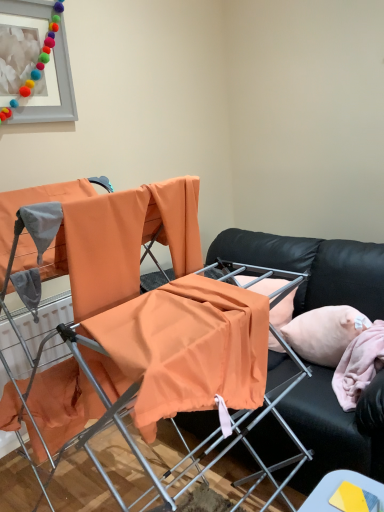
Question: From their relative heights in the image, would you say orange fabric chair at center is taller or shorter than black leather couch at center?

Choices:
 (A) tall
 (B) short

Answer: (A)

Question: Based on their sizes in the image, would you say orange fabric chair at center is bigger or smaller than black leather couch at center?

Choices:
 (A) small
 (B) big

Answer: (B)

Question: Which object is positioned closest to the orange fabric chair at center?

Choices:
 (A) smooth yellow card at lower right
 (B) matte gray picture frame at upper left
 (C) pink fabric pillow at right
 (D) black leather couch at center

Answer: (A)

Question: Which object is positioned closest to the matte gray picture frame at upper left?

Choices:
 (A) orange fabric chair at center
 (B) smooth yellow card at lower right
 (C) black leather couch at center
 (D) pink fabric pillow at right

Answer: (A)